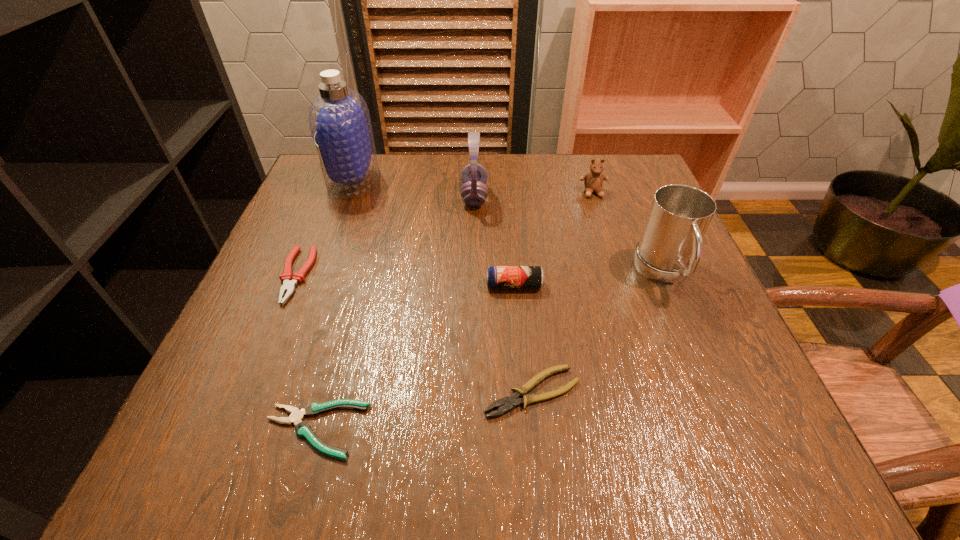
This screenshot has height=540, width=960. I want to click on the tallest object, so click(339, 119).

In order to click on headset in this screenshot , I will do [474, 191].

Image resolution: width=960 pixels, height=540 pixels. Find the location of `the rightmost object`. the rightmost object is located at coordinates (669, 250).

In order to click on teddy bear in this screenshot , I will do `click(593, 181)`.

Find the location of a particular element. The height and width of the screenshot is (540, 960). the second object from right to left is located at coordinates (593, 181).

You are a GUI agent. You are given a task and a screenshot of the screen. Output one action in this format:
    pyautogui.click(x=<x>, y=<y>)
    Task: Click on the fifth tallest object
    
    Given the screenshot: What is the action you would take?
    pyautogui.click(x=497, y=276)

Identify the location of the farthest pliers. This screenshot has height=540, width=960. (289, 281).

Find the location of a particular element. The width and height of the screenshot is (960, 540). the tallest pliers is located at coordinates pos(289,281).

Image resolution: width=960 pixels, height=540 pixels. I want to click on the second shortest pliers, so click(510, 402).

At what (x,y) coordinates should I click in order to perform the action: click on the seventh tallest object. Please return your answer as a coordinate pair (x, y). The image size is (960, 540). Looking at the image, I should click on (510, 402).